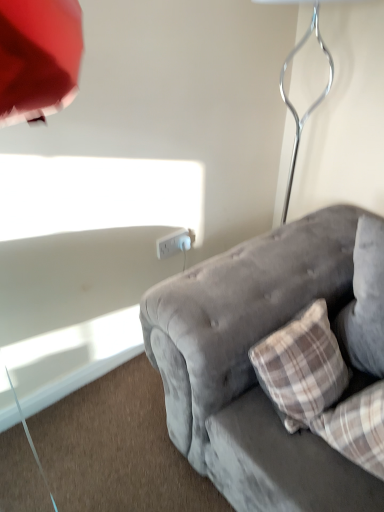
Question: Do you think white plastic power outlet at center is within velvet gray couch at lower right, or outside of it?

Choices:
 (A) outside
 (B) inside

Answer: (A)

Question: Would you say white plastic power outlet at center is to the left or to the right of velvet gray couch at lower right in the picture?

Choices:
 (A) right
 (B) left

Answer: (B)

Question: Based on their relative distances, which object is farther from the velvet gray couch at lower right?

Choices:
 (A) metallic silver table lamp at upper right
 (B) white plastic power outlet at center

Answer: (A)

Question: Estimate the real-world distances between objects in this image. Which object is farther from the white plastic power outlet at center?

Choices:
 (A) velvet gray couch at lower right
 (B) metallic silver table lamp at upper right

Answer: (B)